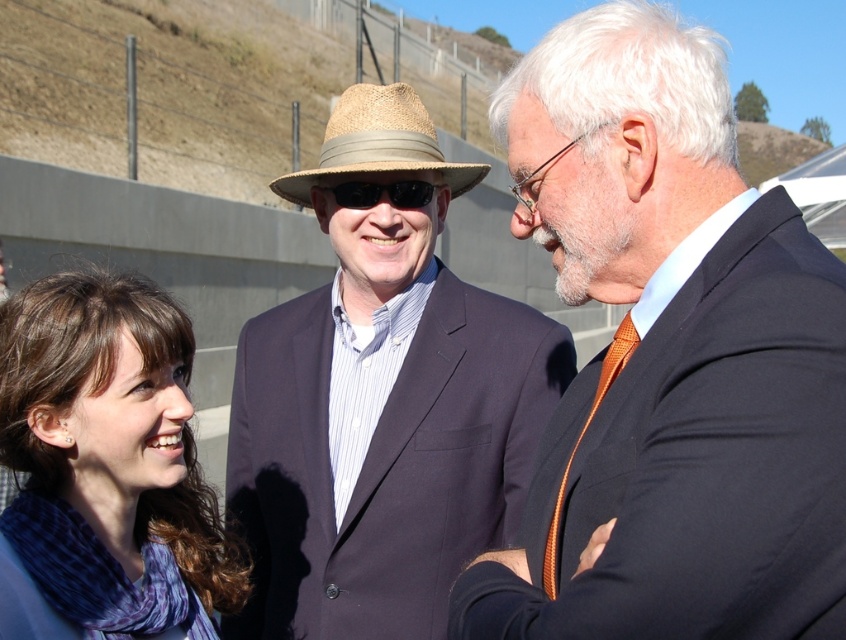
You are a photographer trying to capture a clear shot of the matte black suit at center and the strawhat at center. Since you want to ensure both are visible, which object should you focus on first to account for their sizes?

The matte black suit at center is larger than the strawhat at center, so you should focus on the matte black suit at center first to ensure it is in clear focus before adjusting for the smaller strawhat at center.